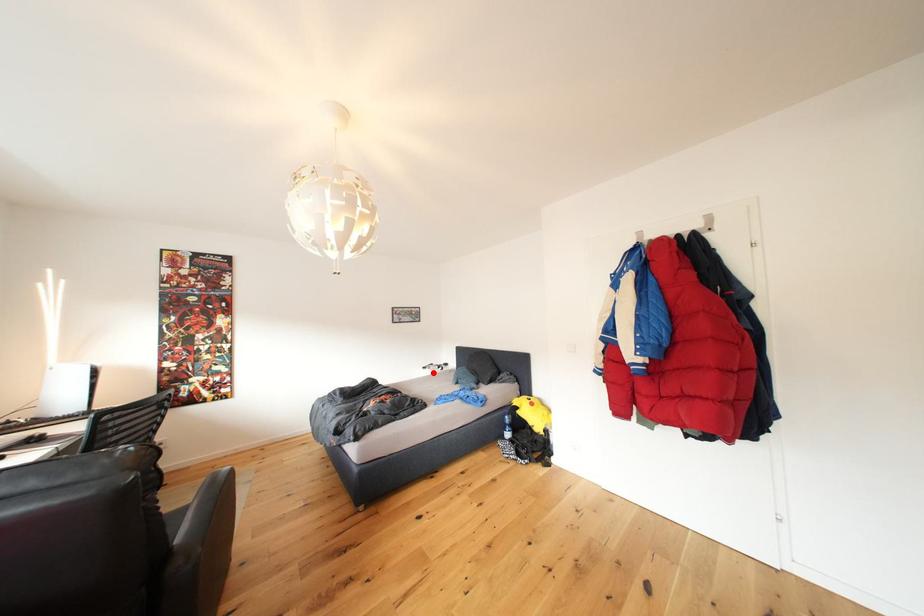
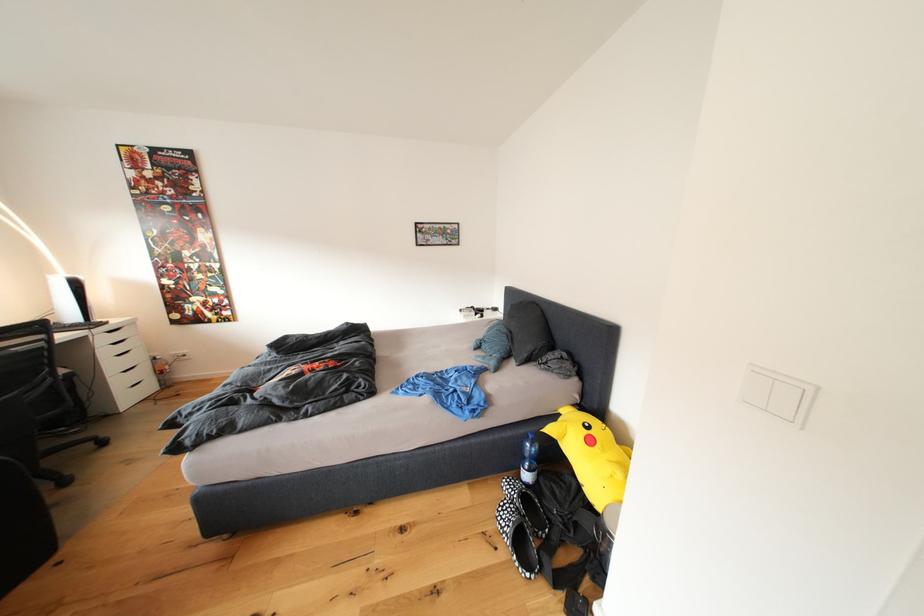
Question: I am providing you with two images of the same scene from different viewpoints. A red point is marked on the first image. Can you still see the location of the red point in image 2?

Choices:
 (A) Yes
 (B) No

Answer: (A)